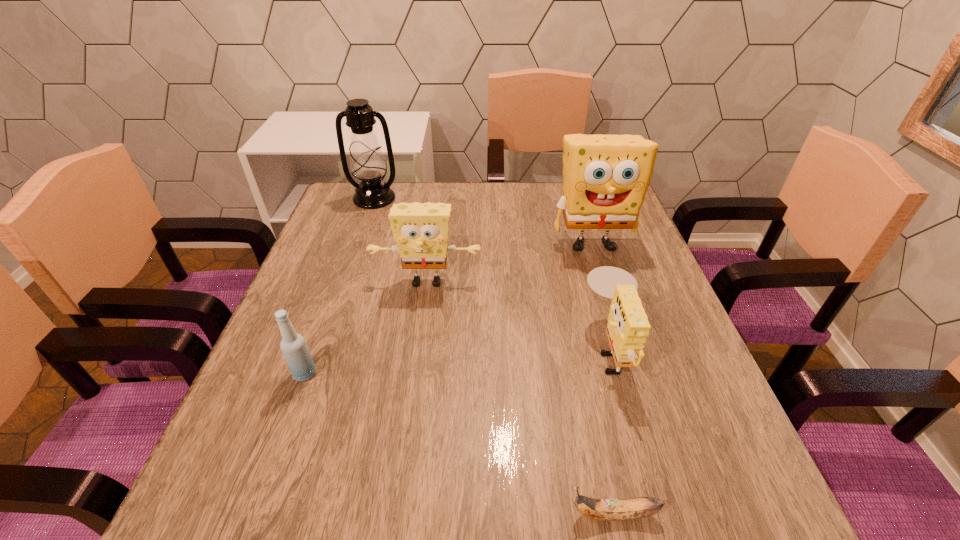
The image size is (960, 540). I want to click on empty space that is in between the nearest sponge and the second nearest sponge, so click(x=518, y=315).

Locate an element on the screen. The image size is (960, 540). vacant area between the shortest object and the farthest object is located at coordinates [x=493, y=356].

At what (x,y) coordinates should I click in order to perform the action: click on vacant area that lies between the bottle and the farthest sponge. Please return your answer as a coordinate pair (x, y). Looking at the image, I should click on (449, 308).

What are the coordinates of `unoccupied position between the bottle and the fourth shortest object` in the screenshot? It's located at (366, 328).

Find the location of a particular element. free point between the tallest sponge and the bottle is located at coordinates (449, 308).

The width and height of the screenshot is (960, 540). I want to click on free space between the second farthest sponge and the second farthest object, so click(510, 262).

At what (x,y) coordinates should I click in order to perform the action: click on vacant area that lies between the bottle and the nearest sponge. Please return your answer as a coordinate pair (x, y). Looking at the image, I should click on (458, 361).

Locate which object is the fourth closest to the leftmost sponge. Please provide its 2D coordinates. Your answer should be formatted as a tuple, i.e. [(x, y)], where the tuple contains the x and y coordinates of a point satisfying the conditions above.

[(367, 163)]

At what (x,y) coordinates should I click in order to perform the action: click on object identified as the fourth closest to the shortest object. Please return your answer as a coordinate pair (x, y). Image resolution: width=960 pixels, height=540 pixels. Looking at the image, I should click on (605, 177).

Locate an element on the screen. The width and height of the screenshot is (960, 540). the second closest sponge to the second farthest object is located at coordinates (421, 230).